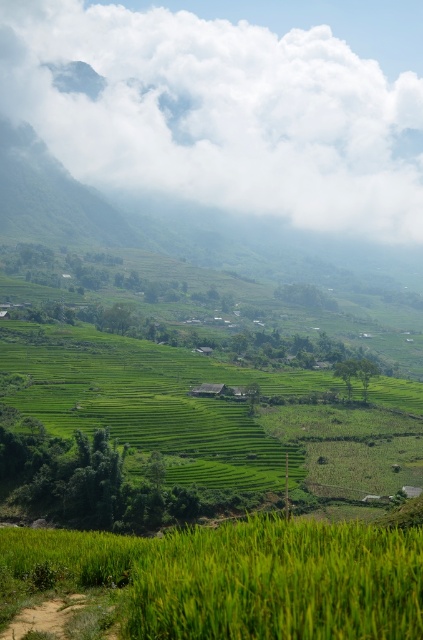
You are a photographer planning to capture the entire scene of the terraced rice fields. You notice the white fluffy cloud at upper center and the green grassy field at center. Which object is located to the right of the other?

The white fluffy cloud at upper center is positioned on the right side of green grassy field at center.

You are standing in the terraced rice fields and want to take a photo. There are two points of interest marked as point 1 and point 2. Point 1 is located at coordinates [297,64] and point 2 is at [362,612]. Which point is closer to you so that I can focus the camera properly?

Point 1 at [297,64] is closer to you than point 2 at [362,612] because it is further to the camera, so focusing on point 1 would ensure proper focus.

Based on the photo, you are a farmer standing at the edge of the green grassy rice field at lower center. You want to reach the green grassy field at center to check the irrigation system. Which direction should you walk to get there?

The green grassy field at center is to the left of green grassy rice field at lower center, so you should walk to the left to reach it.